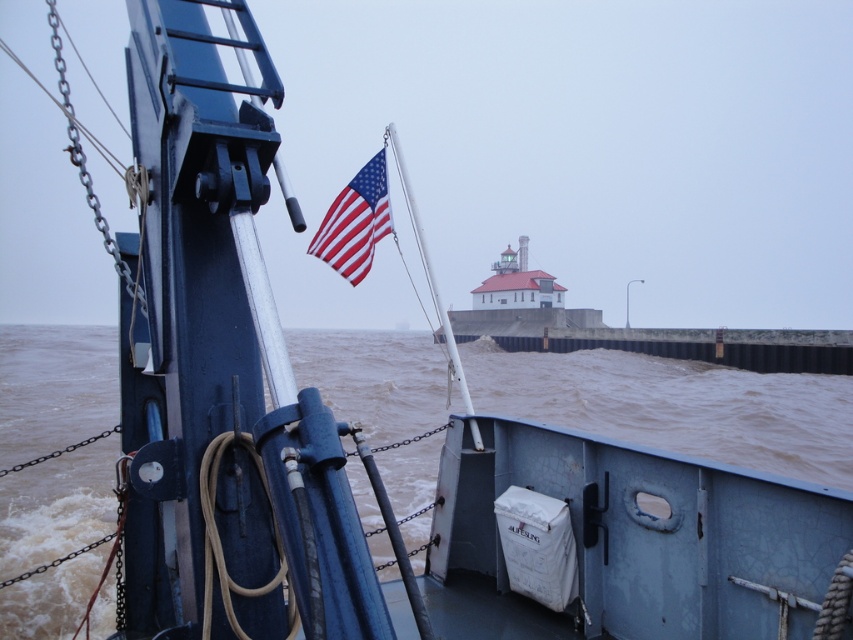
Question: Is brown muddy water at lower center closer to the viewer compared to red/white striped fabric flag at center?

Choices:
 (A) yes
 (B) no

Answer: (B)

Question: Does brown muddy water at lower center appear under red/white striped fabric flag at center?

Choices:
 (A) no
 (B) yes

Answer: (B)

Question: Which object appears closest to the camera in this image?

Choices:
 (A) red/white striped fabric flag at center
 (B) brown muddy water at lower center

Answer: (A)

Question: Does brown muddy water at lower center appear under red/white striped fabric flag at center?

Choices:
 (A) no
 (B) yes

Answer: (B)